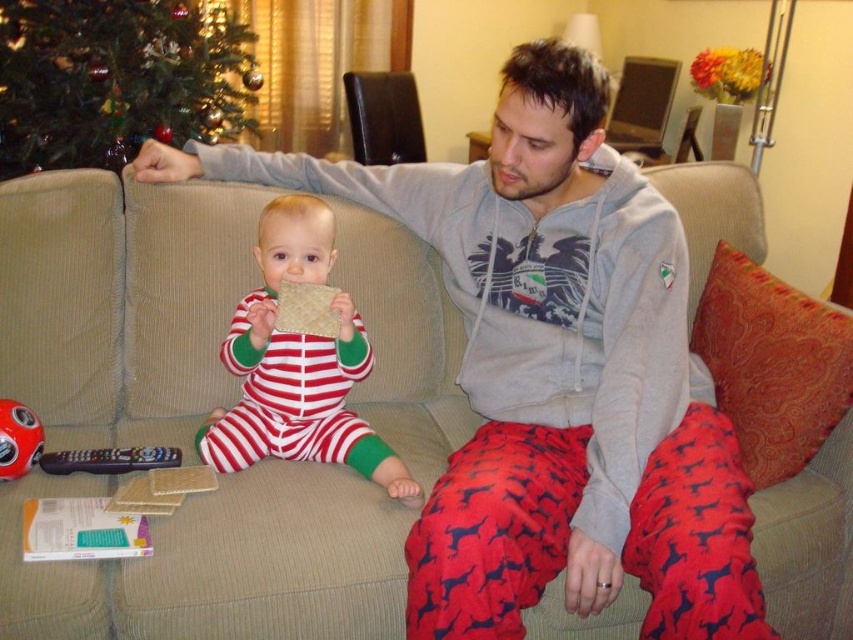
Which is below, green matte christmas tree at upper left or black plastic remote control at lower left?

black plastic remote control at lower left is below.

Locate an element on the screen. The width and height of the screenshot is (853, 640). green matte christmas tree at upper left is located at coordinates (117, 80).

This screenshot has height=640, width=853. Identify the location of green matte christmas tree at upper left. (117, 80).

The height and width of the screenshot is (640, 853). In order to click on green matte christmas tree at upper left in this screenshot , I will do `click(117, 80)`.

From the picture: Does striped cotton onesie at center have a greater width compared to black plastic remote control at lower left?

Yes, striped cotton onesie at center is wider than black plastic remote control at lower left.

Is striped cotton onesie at center positioned in front of black plastic remote control at lower left?

That is True.

Find the location of a particular element. The width and height of the screenshot is (853, 640). striped cotton onesie at center is located at coordinates (299, 364).

Which is above, green matte christmas tree at upper left or striped cotton onesie at center?

green matte christmas tree at upper left is higher up.

Measure the distance between point (228,132) and camera.

Point (228,132) is 9.59 feet away from camera.

Is point (164, 92) behind point (294, 442)?

Yes, it is.

The image size is (853, 640). I want to click on green matte christmas tree at upper left, so click(117, 80).